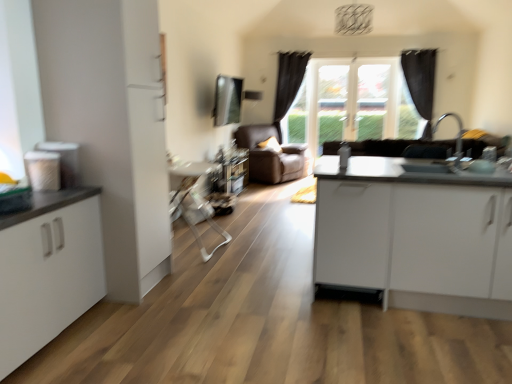
The height and width of the screenshot is (384, 512). Find the location of `free space to the back side of metallic silver table at center, which is counted as the 1th table, starting from the left`. free space to the back side of metallic silver table at center, which is counted as the 1th table, starting from the left is located at coordinates (203, 232).